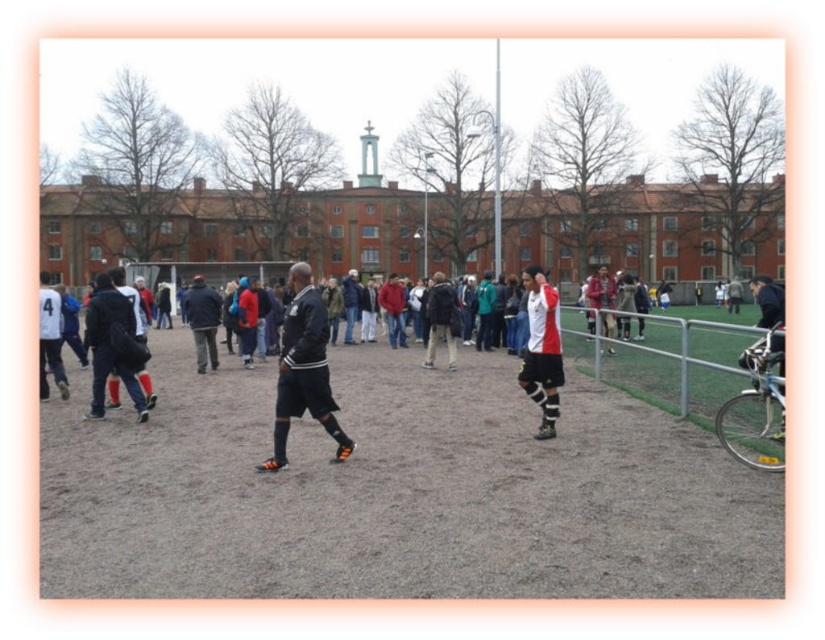
You are a photographer trying to capture a photo of the white and red jersey at center and the brown dirt field at center. Based on their positions, which object would appear closer to the camera in the final photo?

The white and red jersey at center appears closer to the camera because it has a greater height than the brown dirt field at center.

You are a photographer standing at the edge of the soccer field. You want to take a photo that includes both the brown dirt field at center and the black leather jacket at center. According to the scene description, which object should you position to the left side of your camera frame to include both?

To include both the brown dirt field at center and the black leather jacket at center in the photo, you should position the black leather jacket at center on the left side of your camera frame since the brown dirt field at center is located to the right of it.

You are a photographer standing at the edge of the soccer field. You want to take a photo that includes both the brown dirt field at center and the black leather jacket at center. Which object will appear larger in your photo?

The brown dirt field at center will appear larger in the photo because it is closer to the viewer than the black leather jacket at center.